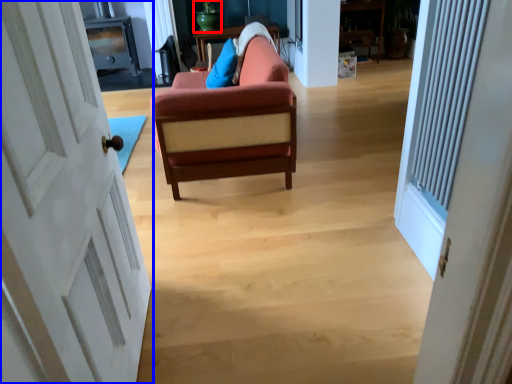
Question: Which of the following is the closest to the observer, teal (highlighted by a red box) or door (highlighted by a blue box)?

Choices:
 (A) teal
 (B) door

Answer: (B)